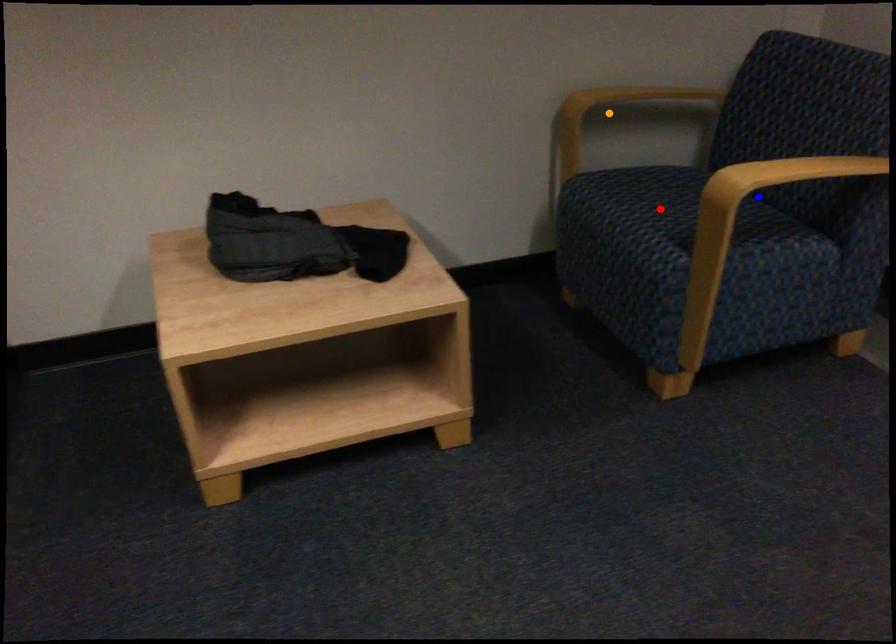
Order these from nearest to farthest:
orange point, red point, blue point

blue point < red point < orange point